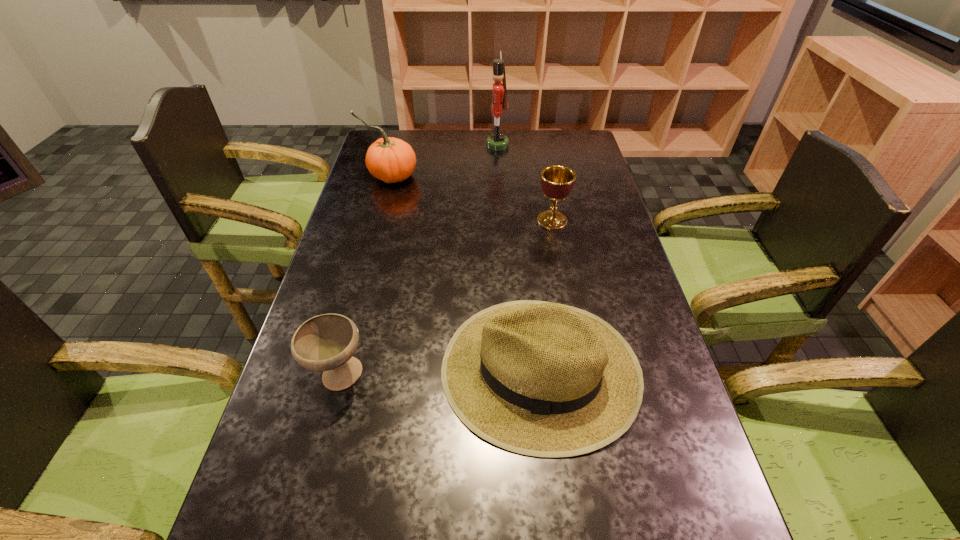
At what (x,y) coordinates should I click in order to perform the action: click on sunhat that is positioned at the right edge. Please return your answer as a coordinate pair (x, y). Looking at the image, I should click on (543, 379).

You are a GUI agent. You are given a task and a screenshot of the screen. Output one action in this format:
    pyautogui.click(x=<x>, y=<y>)
    Task: Click on the free space at the far edge of the desktop
    The image size is (960, 540).
    Given the screenshot: What is the action you would take?
    pyautogui.click(x=509, y=160)

This screenshot has height=540, width=960. In order to click on vacant space at the left edge of the desktop in this screenshot , I will do `click(352, 231)`.

At what (x,y) coordinates should I click in order to perform the action: click on vacant space at the right edge of the desktop. Please return your answer as a coordinate pair (x, y). This screenshot has width=960, height=540. Looking at the image, I should click on (593, 171).

The image size is (960, 540). I want to click on vacant area at the far left corner, so click(x=378, y=134).

Where is `vacant space at the far right corner of the desktop`? This screenshot has width=960, height=540. vacant space at the far right corner of the desktop is located at coordinates (567, 137).

Where is `vacant area that lies between the second tallest object and the sunhat`? This screenshot has width=960, height=540. vacant area that lies between the second tallest object and the sunhat is located at coordinates point(466,273).

You are a GUI agent. You are given a task and a screenshot of the screen. Output one action in this format:
    pyautogui.click(x=<x>, y=<y>)
    Task: Click on the vacant region between the nutcracker and the nearer chalice
    The image size is (960, 540).
    Given the screenshot: What is the action you would take?
    pyautogui.click(x=419, y=261)

The width and height of the screenshot is (960, 540). I want to click on vacant space in between the tallest object and the fourth nearest object, so click(444, 161).

Where is `blank region between the second tallest object and the left chalice`? The image size is (960, 540). blank region between the second tallest object and the left chalice is located at coordinates (365, 276).